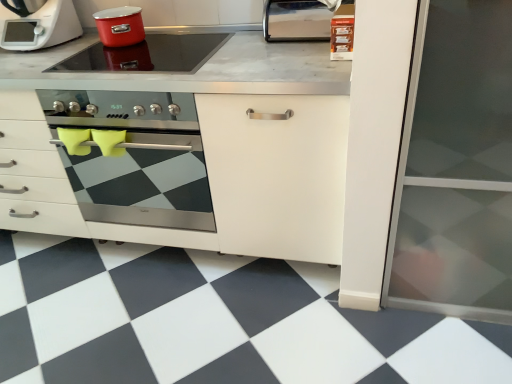
Find the location of a particular element. This screenshot has height=384, width=512. free spot to the right of smooth glass cooktop at upper center, which is the first kitchen appliance in bottom-to-top order is located at coordinates (262, 55).